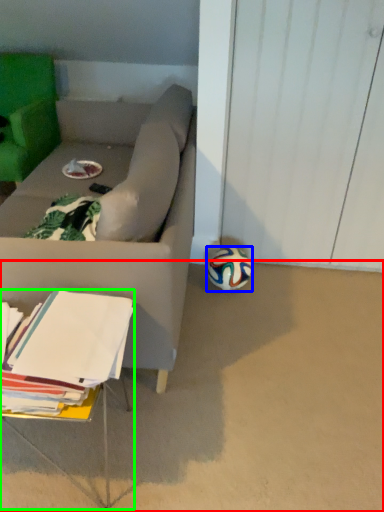
Question: Which is farther away from concrete (highlighted by a red box)? ball (highlighted by a blue box) or table (highlighted by a green box)?

Choices:
 (A) ball
 (B) table

Answer: (A)